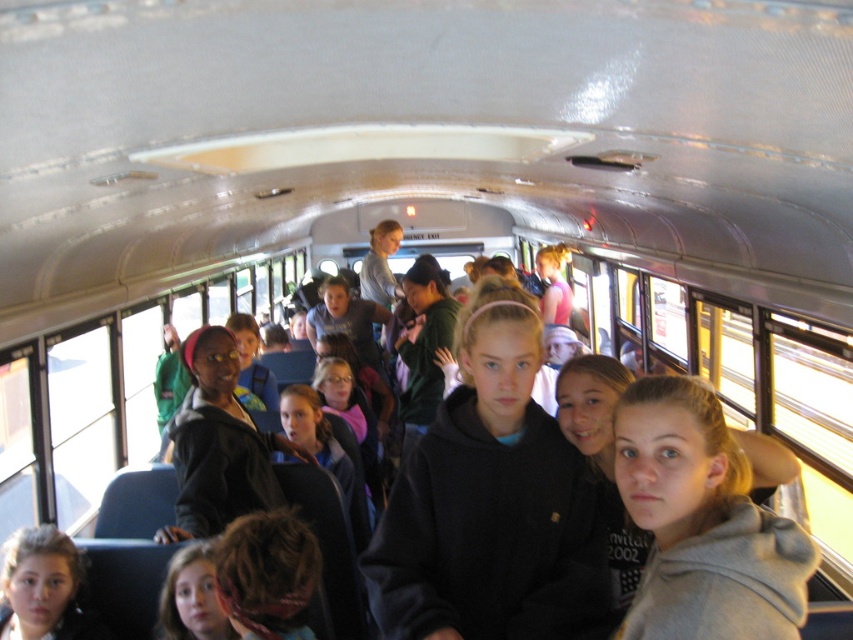
Can you confirm if black matte sweatshirt at center is positioned to the left of matte black hoodie at lower left?

Incorrect, black matte sweatshirt at center is not on the left side of matte black hoodie at lower left.

Between black matte sweatshirt at center and matte black hoodie at lower left, which one is positioned lower?

matte black hoodie at lower left is below.

What do you see at coordinates (491, 502) in the screenshot? I see `black matte sweatshirt at center` at bounding box center [491, 502].

You are a GUI agent. You are given a task and a screenshot of the screen. Output one action in this format:
    pyautogui.click(x=<x>, y=<y>)
    Task: Click on the black matte sweatshirt at center
    
    Given the screenshot: What is the action you would take?
    pyautogui.click(x=491, y=502)